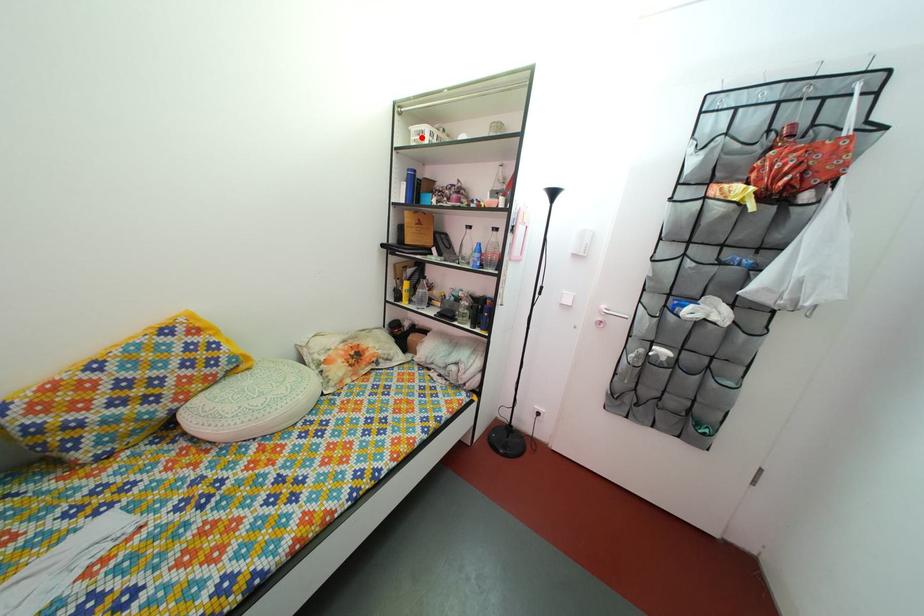
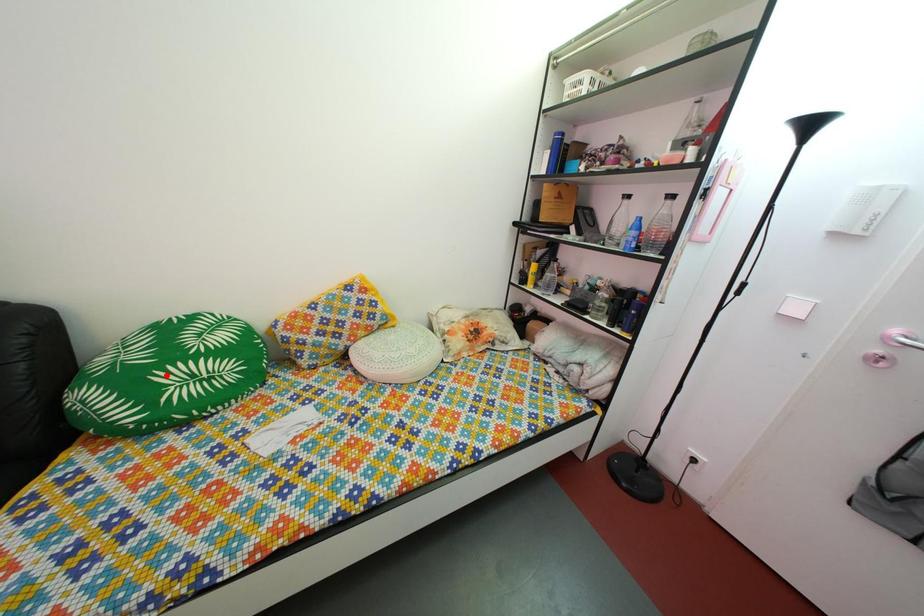
I am providing you with two images of the same scene from different viewpoints. A red point is marked on the first image and another point is marked on the second image. Is the marked point in image1 the same physical position as the marked point in image2?

No